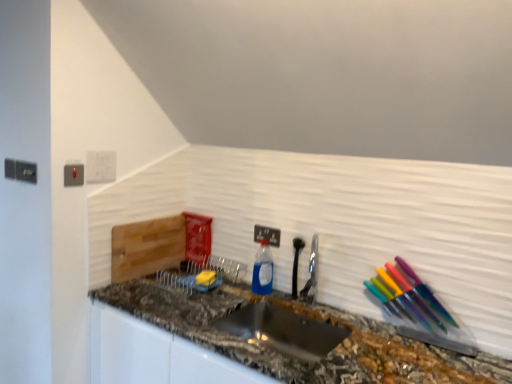
Question: Is white plastic electric outlet at center, marked as the first electric outlet in a back-to-front arrangement, far from white plastic light switch at upper left?

Choices:
 (A) yes
 (B) no

Answer: (B)

Question: Is white plastic electric outlet at center, the 2th electric outlet when ordered from front to back, facing away from white plastic light switch at upper left?

Choices:
 (A) yes
 (B) no

Answer: (B)

Question: From a real-world perspective, is white plastic electric outlet at center, marked as the first electric outlet in a back-to-front arrangement, below white plastic light switch at upper left?

Choices:
 (A) no
 (B) yes

Answer: (B)

Question: Can you confirm if white plastic electric outlet at center, which is counted as the 1th electric outlet, starting from the right, is thinner than white plastic light switch at upper left?

Choices:
 (A) yes
 (B) no

Answer: (B)

Question: From the image's perspective, is white plastic electric outlet at center, marked as the first electric outlet in a back-to-front arrangement, over white plastic light switch at upper left?

Choices:
 (A) yes
 (B) no

Answer: (B)

Question: Does white plastic electric outlet at center, placed as the second electric outlet when sorted from top to bottom, have a greater width compared to white plastic light switch at upper left?

Choices:
 (A) yes
 (B) no

Answer: (A)

Question: Is white plastic electric outlet at center, marked as the first electric outlet in a back-to-front arrangement, turned away from stainless steel sink at center?

Choices:
 (A) no
 (B) yes

Answer: (A)

Question: Can you confirm if white plastic electric outlet at center, which is counted as the 1th electric outlet, starting from the right, is taller than stainless steel sink at center?

Choices:
 (A) yes
 (B) no

Answer: (B)

Question: Is white plastic electric outlet at center, the 2th electric outlet when ordered from front to back, thinner than stainless steel sink at center?

Choices:
 (A) no
 (B) yes

Answer: (B)

Question: From a real-world perspective, is white plastic electric outlet at center, the 2th electric outlet when ordered from front to back, positioned over stainless steel sink at center based on gravity?

Choices:
 (A) yes
 (B) no

Answer: (A)

Question: Could you tell me if white plastic electric outlet at center, which ranks as the 1th electric outlet in bottom-to-top order, is facing stainless steel sink at center?

Choices:
 (A) yes
 (B) no

Answer: (B)

Question: From a real-world perspective, is white plastic electric outlet at center, marked as the first electric outlet in a back-to-front arrangement, positioned under stainless steel sink at center based on gravity?

Choices:
 (A) yes
 (B) no

Answer: (B)

Question: Is satin nickel faucet at center a part of blue translucent bottle at center?

Choices:
 (A) no
 (B) yes

Answer: (A)